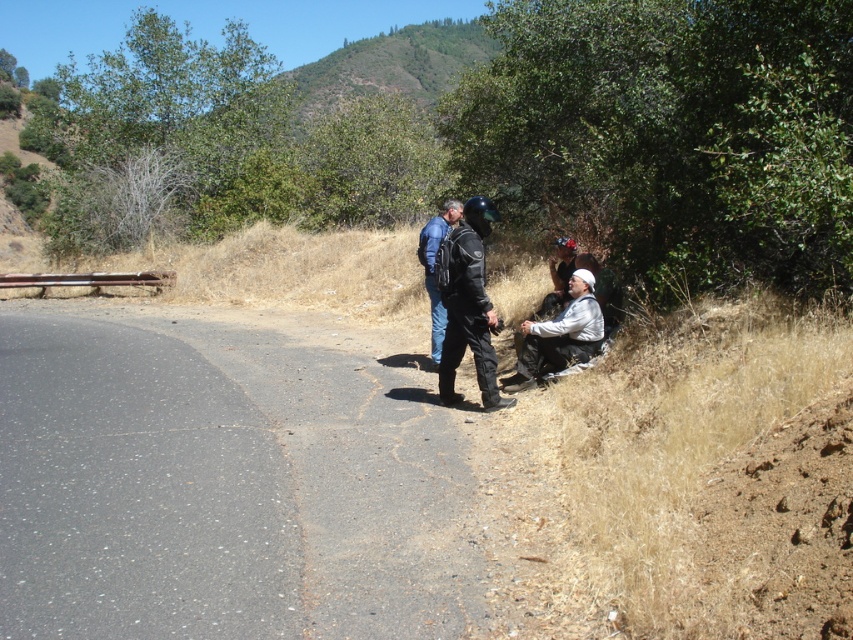
Question: Can you confirm if asphalt road at left is thinner than white matte jacket at lower right?

Choices:
 (A) yes
 (B) no

Answer: (B)

Question: Based on their relative distances, which object is farther from the black leather jacket at center?

Choices:
 (A) asphalt road at left
 (B) matte black jacket at center

Answer: (A)

Question: Can you confirm if asphalt road at left is wider than black leather jacket at center?

Choices:
 (A) yes
 (B) no

Answer: (A)

Question: Which point is farther to the camera?

Choices:
 (A) (572, 349)
 (B) (437, 339)

Answer: (B)

Question: Can you confirm if black leather jacket at center is positioned above matte black jacket at center?

Choices:
 (A) yes
 (B) no

Answer: (B)

Question: Which point appears closest to the camera in this image?

Choices:
 (A) (85, 538)
 (B) (482, 352)

Answer: (A)